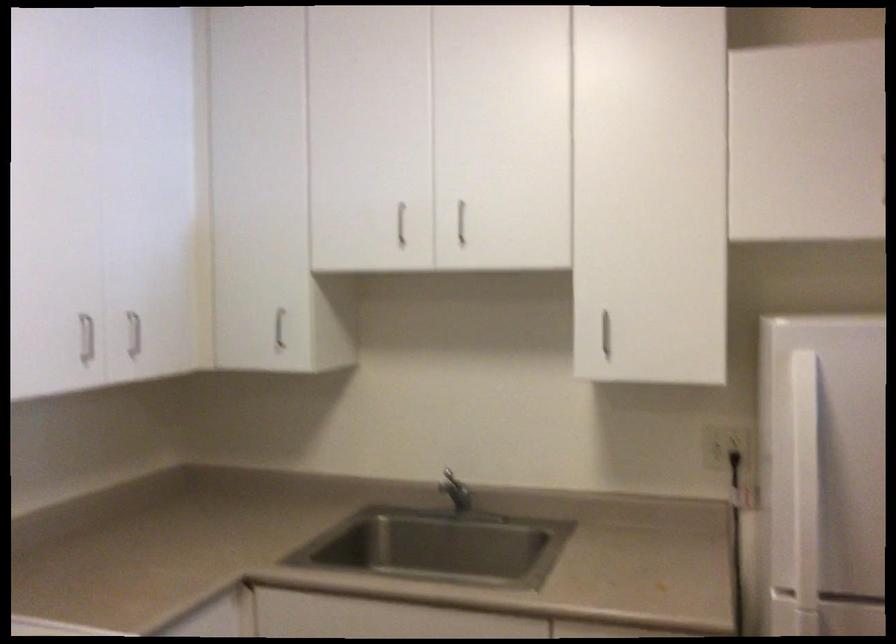
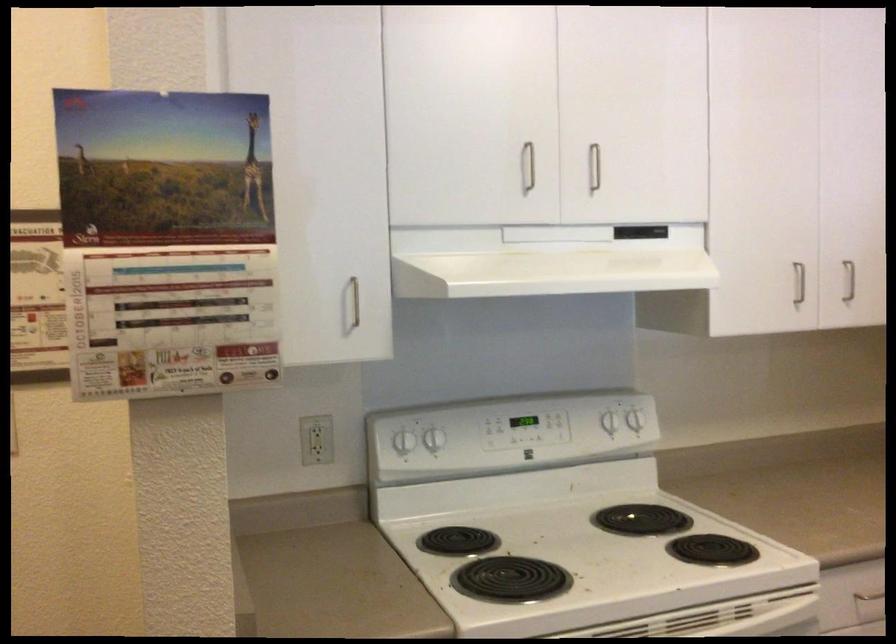
Where in the second image is the point corresponding to (128,335) from the first image?

(849, 281)